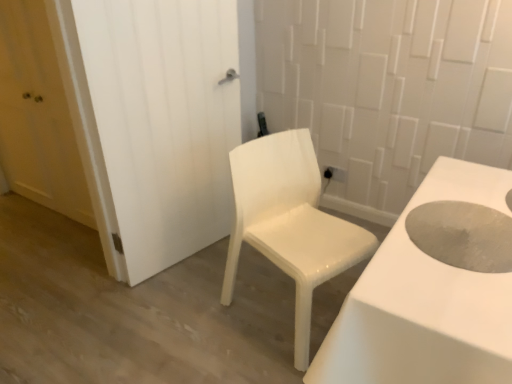
Where is `vacant space that is to the left of white glossy chair at center`? vacant space that is to the left of white glossy chair at center is located at coordinates (195, 317).